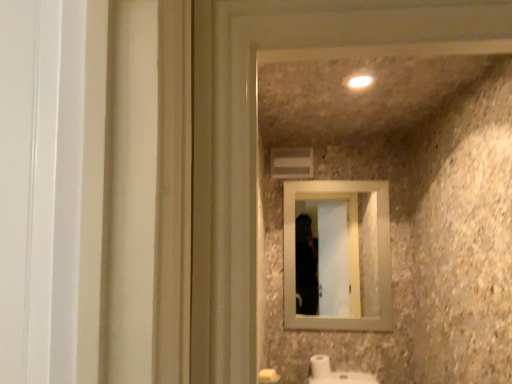
Question: Considering the positions of beige wood mirror at center and white glossy light at upper center in the image, is beige wood mirror at center bigger or smaller than white glossy light at upper center?

Choices:
 (A) big
 (B) small

Answer: (A)

Question: Is beige wood mirror at center wider or thinner than white glossy light at upper center?

Choices:
 (A) thin
 (B) wide

Answer: (A)

Question: Which object is the closest to the beige wood mirror at center?

Choices:
 (A) white matte toilet paper at lower center
 (B) white glossy light at upper center

Answer: (A)

Question: Estimate the real-world distances between objects in this image. Which object is farther from the white glossy light at upper center?

Choices:
 (A) white matte toilet paper at lower center
 (B) beige wood mirror at center

Answer: (B)